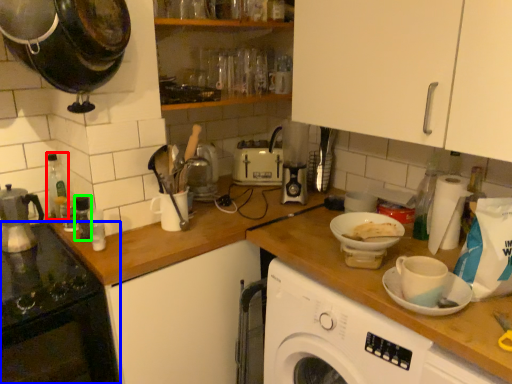
Question: Based on their relative distances, which object is farther from bottle (highlighted by a red box)? Choose from home appliance (highlighted by a blue box) and bottle (highlighted by a green box).

Choices:
 (A) home appliance
 (B) bottle

Answer: (A)